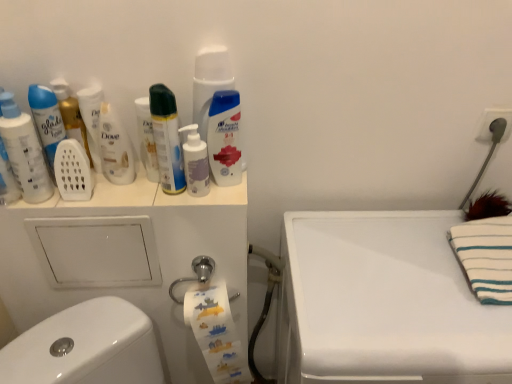
Locate an element on the screen. This screenshot has height=384, width=512. free space above white glossy counter top at upper right (from a real-world perspective) is located at coordinates (398, 271).